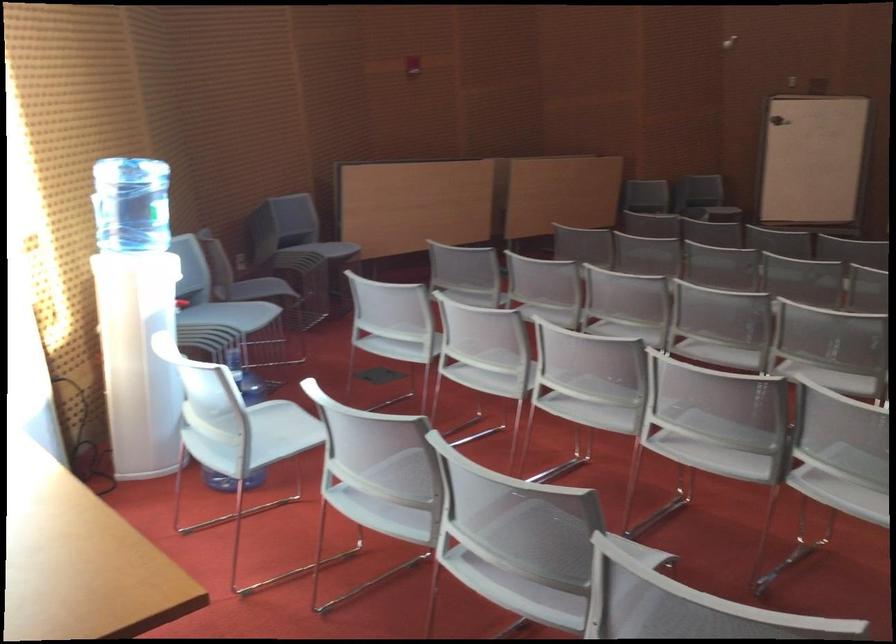
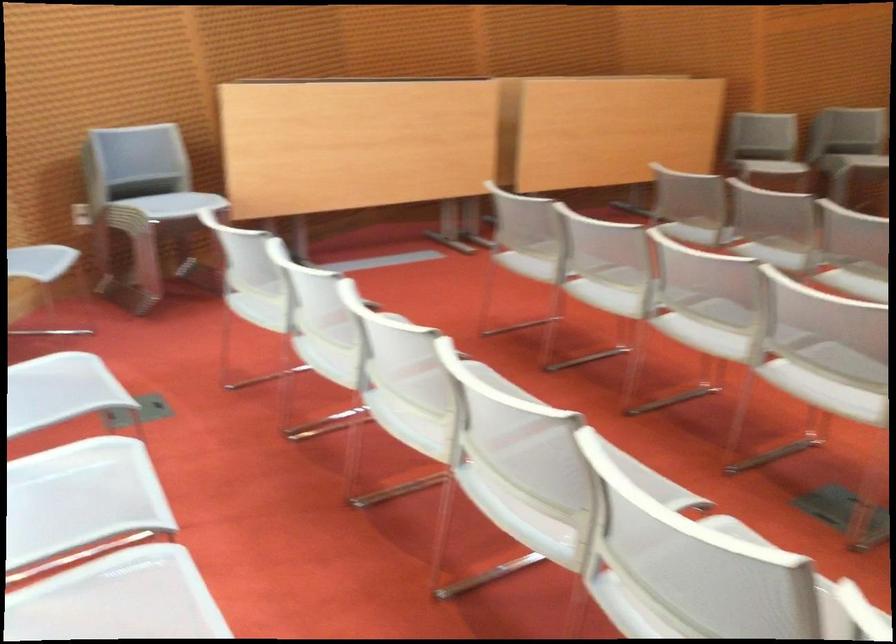
In a continuous first-person perspective shot, in which direction is the camera moving?

The cameraman moved toward right, forward.